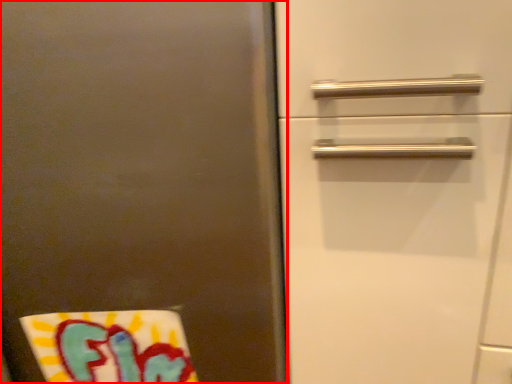
Question: Where is door (annotated by the red box) located in relation to beach towel in the image?

Choices:
 (A) left
 (B) right

Answer: (A)